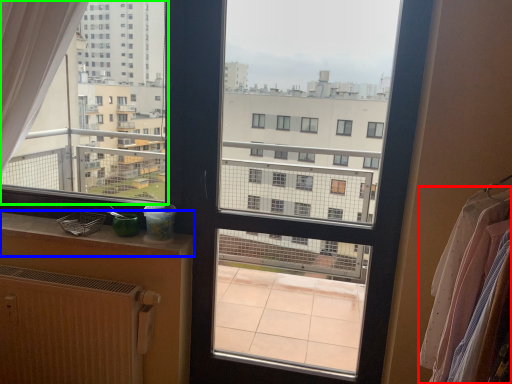
Question: Which is nearer to the clothing (highlighted by a red box)? window sill (highlighted by a blue box) or condominium (highlighted by a green box).

Choices:
 (A) window sill
 (B) condominium

Answer: (A)